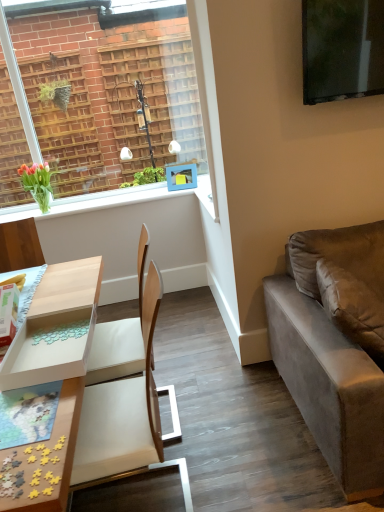
Question: Is light blue plastic picture frame at upper center positioned far away from suede gray couch at right?

Choices:
 (A) yes
 (B) no

Answer: (A)

Question: Is light blue plastic picture frame at upper center directly adjacent to suede gray couch at right?

Choices:
 (A) yes
 (B) no

Answer: (B)

Question: Can you confirm if light blue plastic picture frame at upper center is shorter than suede gray couch at right?

Choices:
 (A) yes
 (B) no

Answer: (A)

Question: Is light blue plastic picture frame at upper center located outside suede gray couch at right?

Choices:
 (A) yes
 (B) no

Answer: (A)

Question: Is light blue plastic picture frame at upper center at the left side of suede gray couch at right?

Choices:
 (A) yes
 (B) no

Answer: (A)

Question: Is green glass vase at upper left situated inside light blue plastic picture frame at upper center or outside?

Choices:
 (A) outside
 (B) inside

Answer: (A)

Question: Considering their positions, is green glass vase at upper left located in front of or behind light blue plastic picture frame at upper center?

Choices:
 (A) behind
 (B) front

Answer: (B)

Question: From the image's perspective, is green glass vase at upper left positioned above or below light blue plastic picture frame at upper center?

Choices:
 (A) above
 (B) below

Answer: (B)

Question: Does point (19, 205) appear closer or farther from the camera than point (170, 188)?

Choices:
 (A) farther
 (B) closer

Answer: (B)

Question: Is point (64, 44) closer or farther from the camera than point (324, 428)?

Choices:
 (A) closer
 (B) farther

Answer: (B)

Question: From a real-world perspective, is clear glass window at upper left positioned above or below suede gray couch at right?

Choices:
 (A) below
 (B) above

Answer: (B)

Question: Considering their positions, is clear glass window at upper left located in front of or behind suede gray couch at right?

Choices:
 (A) front
 (B) behind

Answer: (B)

Question: In terms of size, does clear glass window at upper left appear bigger or smaller than suede gray couch at right?

Choices:
 (A) small
 (B) big

Answer: (A)

Question: From the image's perspective, is green glass vase at upper left located above or below light wood/wooden desk at lower left?

Choices:
 (A) above
 (B) below

Answer: (A)

Question: From a real-world perspective, relative to light wood/wooden desk at lower left, is green glass vase at upper left vertically above or below?

Choices:
 (A) above
 (B) below

Answer: (A)